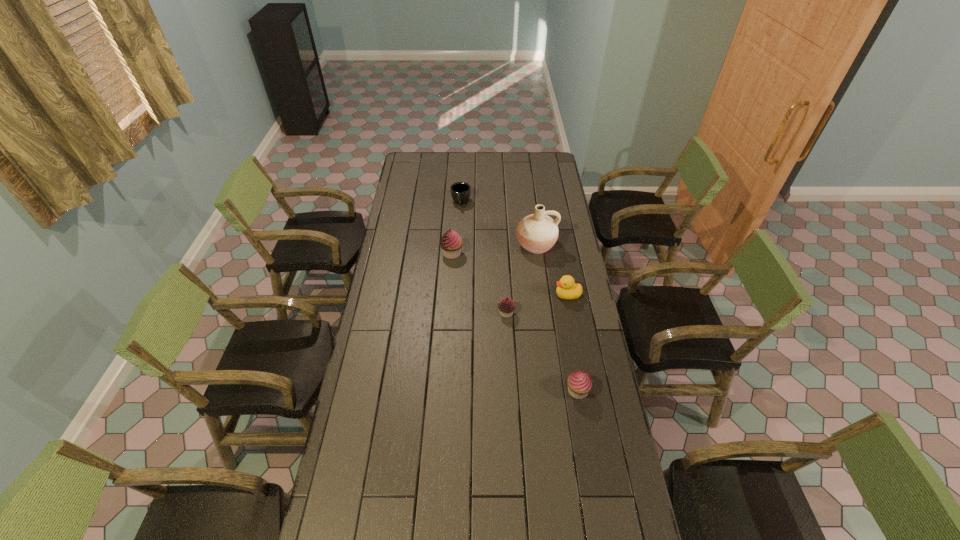
Find the location of a particular element. This screenshot has height=540, width=960. vacant space at the far edge is located at coordinates (490, 167).

Find the location of `vacant space at the near edge of the desktop`. vacant space at the near edge of the desktop is located at coordinates (536, 510).

I want to click on free region at the left edge of the desktop, so click(x=408, y=230).

In the image, there is a desktop. In order to click on free region at the right edge in this screenshot , I will do `click(559, 196)`.

Find the location of a particular element. This screenshot has height=540, width=960. vacant space at the far left corner is located at coordinates (414, 160).

Where is `vacant space at the far right corner of the desktop`? Image resolution: width=960 pixels, height=540 pixels. vacant space at the far right corner of the desktop is located at coordinates (544, 159).

You are a GUI agent. You are given a task and a screenshot of the screen. Output one action in this format:
    pyautogui.click(x=<x>, y=<y>)
    Task: Click on the free space at the near right corner of the desktop
    
    Given the screenshot: What is the action you would take?
    pyautogui.click(x=607, y=509)

Locate an element on the screen. free space between the second cupcake from right to left and the fourth farthest object is located at coordinates (537, 303).

Locate an element on the screen. This screenshot has width=960, height=540. blank region between the rightmost cupcake and the third nearest object is located at coordinates (572, 343).

Where is `unoccupied area between the farthest object and the pottery`? This screenshot has height=540, width=960. unoccupied area between the farthest object and the pottery is located at coordinates click(498, 224).